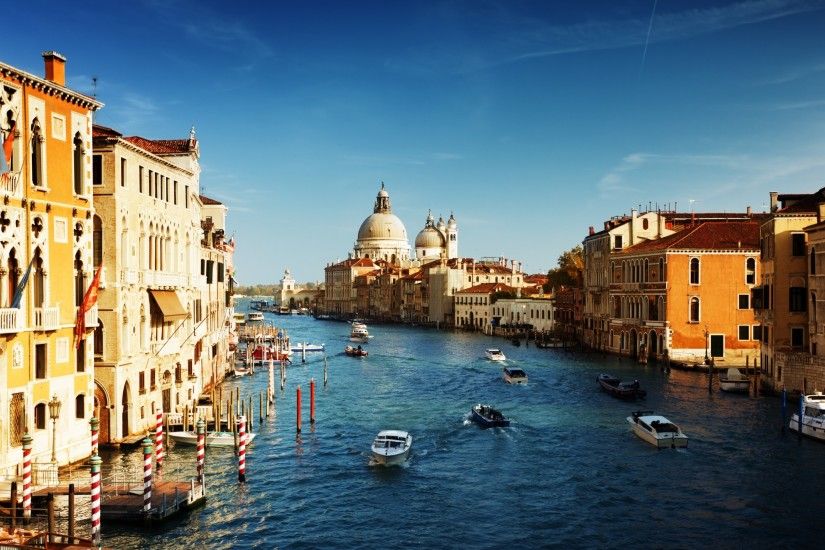
At what (x,y) coordinates should I click in order to perform the action: click on chimney. Please return your answer as a coordinate pair (x, y). Looking at the image, I should click on (52, 73).